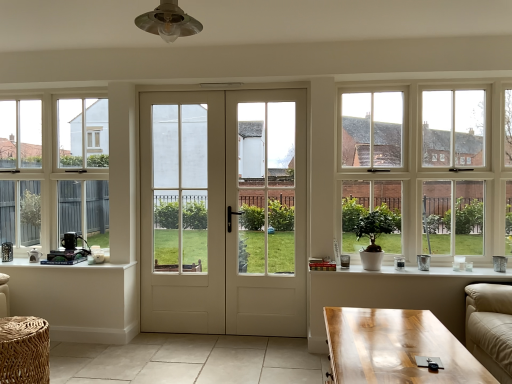
How much space does clear glass window at right, which appears as the second window when viewed from the back, occupy horizontally?

It is 4.19 inches.

Locate an element on the screen. The image size is (512, 384). green glossy plant at right is located at coordinates (373, 237).

Locate an element on the screen. This screenshot has width=512, height=384. woven rattan table at lower left, which is the 1th table from front to back is located at coordinates (24, 350).

This screenshot has width=512, height=384. Describe the element at coordinates (24, 350) in the screenshot. I see `woven rattan table at lower left, which is the 1th table from front to back` at that location.

The image size is (512, 384). What do you see at coordinates (396, 348) in the screenshot?
I see `light brown wooden coffee table at lower right` at bounding box center [396, 348].

Measure the distance between point [377,367] and camera.

The depth of point [377,367] is 5.57 feet.

Image resolution: width=512 pixels, height=384 pixels. I want to click on white glossy door at center, marked as the first screen door in a right-to-left arrangement, so click(266, 212).

At what (x,y) coordinates should I click in order to perform the action: click on white ceramic pot at lower right. Please return your answer as a coordinate pair (x, y). This screenshot has height=384, width=512. Looking at the image, I should click on (421, 273).

Locate an element on the screen. Image resolution: width=512 pixels, height=384 pixels. white matte table at lower left, which appears as the first table when viewed from the back is located at coordinates (78, 299).

What are the coordinates of `clear glass window at right, arranged as the first window when viewed from the front` in the screenshot? It's located at (429, 168).

Is white glossy door at center, marked as the first screen door in a right-to-left arrangement, positioned with its back to white smooth door at center?

That's right, white glossy door at center, marked as the first screen door in a right-to-left arrangement, is facing away from white smooth door at center.

Measure the distance between white glossy door at center, marked as the first screen door in a right-to-left arrangement, and white smooth door at center.

white glossy door at center, marked as the first screen door in a right-to-left arrangement, is 5.46 inches from white smooth door at center.

Are white glossy door at center, the second screen door from the left, and white smooth door at center making contact?

white glossy door at center, the second screen door from the left, is not next to white smooth door at center, and they're not touching.

Between white ceramic pot at lower right and white smooth door at center, which one has smaller width?

Thinner between the two is white smooth door at center.

From the image's perspective, between white ceramic pot at lower right and white smooth door at center, which one is located above?

→ white smooth door at center, from the image's perspective.

What's the angular difference between white ceramic pot at lower right and white smooth door at center's facing directions?

The angular difference between white ceramic pot at lower right and white smooth door at center is 0.0905 degrees.

Considering the sizes of objects white ceramic pot at lower right and white smooth door at center in the image provided, who is shorter, white ceramic pot at lower right or white smooth door at center?

With less height is white ceramic pot at lower right.

Which screen door is the 1st one when counting from the left side of the light brown wooden coffee table at lower right? Please provide its 2D coordinates.

[(266, 212)]

Would you say white glossy door at center, marked as the first screen door in a right-to-left arrangement, is inside or outside light brown wooden coffee table at lower right?

white glossy door at center, marked as the first screen door in a right-to-left arrangement, is outside light brown wooden coffee table at lower right.

Considering the relative sizes of white glossy door at center, the second screen door from the left, and light brown wooden coffee table at lower right in the image provided, is white glossy door at center, the second screen door from the left, smaller than light brown wooden coffee table at lower right?

Correct, white glossy door at center, the second screen door from the left, occupies less space than light brown wooden coffee table at lower right.

From a real-world perspective, is woven rattan table at lower left, which is the second table in back-to-front order, physically located above or below white glossy door at center, the second screen door from the left?

woven rattan table at lower left, which is the second table in back-to-front order, is situated lower than white glossy door at center, the second screen door from the left, in the real world.

Is the depth of woven rattan table at lower left, which is the 1th table from front to back, greater than that of white glossy door at center, the second screen door from the left?

No, woven rattan table at lower left, which is the 1th table from front to back, is in front of white glossy door at center, the second screen door from the left.

From the image's perspective, is woven rattan table at lower left, which is the 1th table from front to back, on top of white glossy door at center, the second screen door from the left?

No, from the image's perspective, woven rattan table at lower left, which is the 1th table from front to back, is not over white glossy door at center, the second screen door from the left.

Does point (44, 381) appear closer or farther from the camera than point (255, 201)?

Point (44, 381) appears to be closer to the viewer than point (255, 201).

In the image, is white ceramic pot at lower right positioned in front of or behind white glossy door at center, marked as the first screen door in a right-to-left arrangement?

In the image, white ceramic pot at lower right appears in front of white glossy door at center, marked as the first screen door in a right-to-left arrangement.

Is white ceramic pot at lower right located outside white glossy door at center, the second screen door from the left?

Yes.

From the image's perspective, between white ceramic pot at lower right and white glossy door at center, the second screen door from the left, which one is located above?

white glossy door at center, the second screen door from the left, appears higher in the image.

Considering the relative sizes of white ceramic pot at lower right and white glossy door at center, marked as the first screen door in a right-to-left arrangement, in the image provided, is white ceramic pot at lower right shorter than white glossy door at center, marked as the first screen door in a right-to-left arrangement,?

Correct, white ceramic pot at lower right is not as tall as white glossy door at center, marked as the first screen door in a right-to-left arrangement.

From a real-world perspective, who is located lower, white ceramic pot at lower right or green glossy plant at right?

In real-world perspective, white ceramic pot at lower right is lower.

Is white ceramic pot at lower right taller than green glossy plant at right?

No, white ceramic pot at lower right is not taller than green glossy plant at right.

Does white ceramic pot at lower right touch green glossy plant at right?

No, white ceramic pot at lower right is not beside green glossy plant at right.

From the image's perspective, which is below, white ceramic pot at lower right or green glossy plant at right?

white ceramic pot at lower right, from the image's perspective.

Between light brown wooden coffee table at lower right and white matte table at lower left, which appears as the first table when viewed from the back, which one has larger size?

light brown wooden coffee table at lower right.

Locate an element on the screen. The image size is (512, 384). coffee table in front of the white matte table at lower left, which appears as the first table when viewed from the back is located at coordinates (396, 348).

From the image's perspective, would you say light brown wooden coffee table at lower right is shown under white matte table at lower left, which ranks as the 2th table in front-to-back order?

Indeed, from the image's perspective, light brown wooden coffee table at lower right is shown beneath white matte table at lower left, which ranks as the 2th table in front-to-back order.

From the picture: Is light brown wooden coffee table at lower right aimed at white matte table at lower left, which appears as the first table when viewed from the back?

Yes, light brown wooden coffee table at lower right faces towards white matte table at lower left, which appears as the first table when viewed from the back.

Locate an element on the screen. The height and width of the screenshot is (384, 512). screen door that is the 1st one below the white smooth door at center (from a real-world perspective) is located at coordinates (266, 212).

Locate an element on the screen. Image resolution: width=512 pixels, height=384 pixels. window sill below the white smooth door at center (from the image's perspective) is located at coordinates (421, 273).

Looking at the image, which one is located closer to white smooth door at center, white matte table at lower left, which ranks as the 2th table in front-to-back order, or clear glass window at left, which is the 1th window from left to right?

The object closer to white smooth door at center is white matte table at lower left, which ranks as the 2th table in front-to-back order.

When comparing their distances from light brown wooden coffee table at lower right, does clear glass window at right, which is the second window in left-to-right order, or green glossy plant at right seem closer?

green glossy plant at right.

Looking at the image, which one is located further to clear glass window at left, which is the 1th window from left to right, white smooth door at center or white glass door at center, which is counted as the 1th screen door, starting from the left?

white smooth door at center is further to clear glass window at left, which is the 1th window from left to right.

Considering their positions, is clear glass window at left, placed as the second window when sorted from right to left, positioned further to light brown wooden coffee table at lower right than green glossy plant at right?

Among the two, clear glass window at left, placed as the second window when sorted from right to left, is located further to light brown wooden coffee table at lower right.

When comparing their distances from clear glass window at left, which is the 1th window from left to right, does light brown wooden coffee table at lower right or white smooth door at center seem further?

Among the two, light brown wooden coffee table at lower right is located further to clear glass window at left, which is the 1th window from left to right.

Based on their spatial positions, is woven rattan table at lower left, which is the 1th table from front to back, or white matte table at lower left, which ranks as the 2th table in front-to-back order, closer to clear glass window at left, arranged as the second window when viewed from the front?

Result: The object closer to clear glass window at left, arranged as the second window when viewed from the front, is white matte table at lower left, which ranks as the 2th table in front-to-back order.

Looking at the image, which one is located closer to white glass door at center, which is counted as the 1th screen door, starting from the left, clear glass window at left, arranged as the second window when viewed from the front, or white glossy door at center, marked as the first screen door in a right-to-left arrangement?

The object closer to white glass door at center, which is counted as the 1th screen door, starting from the left, is white glossy door at center, marked as the first screen door in a right-to-left arrangement.

From the image, which object appears to be nearer to green glossy plant at right, white matte table at lower left, which ranks as the 2th table in front-to-back order, or white ceramic pot at lower right?

white ceramic pot at lower right.

At what (x,y) coordinates should I click in order to perform the action: click on door situated between clear glass window at left, placed as the 1th window when sorted from back to front, and white ceramic pot at lower right from left to right. Please return your answer as a coordinate pair (x, y). Looking at the image, I should click on (224, 212).

You are a GUI agent. You are given a task and a screenshot of the screen. Output one action in this format:
    pyautogui.click(x=<x>, y=<y>)
    Task: Click on the door between woven rattan table at lower left, which is the 1th table from front to back, and white glossy door at center, marked as the first screen door in a right-to-left arrangement
    This screenshot has height=384, width=512.
    Given the screenshot: What is the action you would take?
    tap(224, 212)

Where is `window sill between white glossy door at center, the second screen door from the left, and clear glass window at right, which is the second window in left-to-right order, in the horizontal direction`? The height and width of the screenshot is (384, 512). window sill between white glossy door at center, the second screen door from the left, and clear glass window at right, which is the second window in left-to-right order, in the horizontal direction is located at coordinates (421, 273).

You are a GUI agent. You are given a task and a screenshot of the screen. Output one action in this format:
    pyautogui.click(x=<x>, y=<y>)
    Task: Click on the door between white glass door at center, which is counted as the 1th screen door, starting from the left, and green glossy plant at right, in the horizontal direction
    
    Given the screenshot: What is the action you would take?
    pyautogui.click(x=224, y=212)